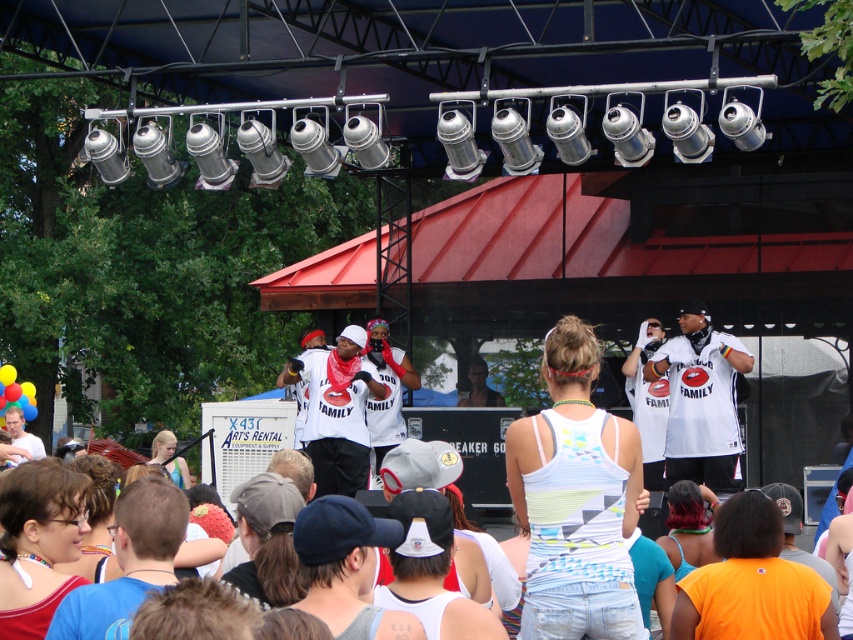
Between white tank top at center and white matte shirt at center, which one has less height?

With less height is white matte shirt at center.

Which is in front, point (590, 429) or point (367, 371)?

Point (590, 429) is in front.

Which is in front, point (560, 426) or point (350, 456)?

Point (560, 426) is more forward.

Image resolution: width=853 pixels, height=640 pixels. Identify the location of white tank top at center. (575, 499).

Which is below, white tank top at center or white jersey at center?

white tank top at center is lower down.

Is white tank top at center below white jersey at center?

Yes, white tank top at center is below white jersey at center.

This screenshot has width=853, height=640. Identify the location of white tank top at center. (575, 499).

Is white jersey at center positioned before white matte shirt at center?

Yes.

Can you confirm if white jersey at center is positioned to the left of white matte shirt at center?

Incorrect, white jersey at center is not on the left side of white matte shirt at center.

Between point (688, 454) and point (328, 364), which one is positioned in front?

Positioned in front is point (688, 454).

Identify the location of white jersey at center. (700, 400).